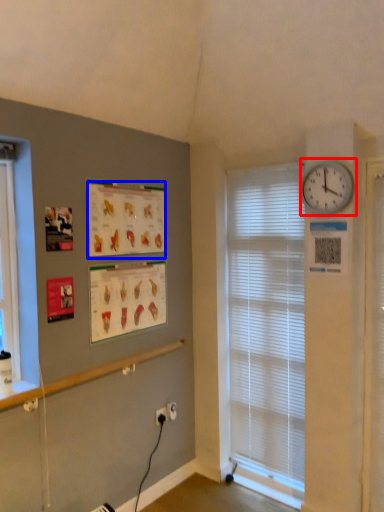
Question: Which point is further to the camera, wall clock (highlighted by a red box) or poster page (highlighted by a blue box)?

Choices:
 (A) wall clock
 (B) poster page

Answer: (B)